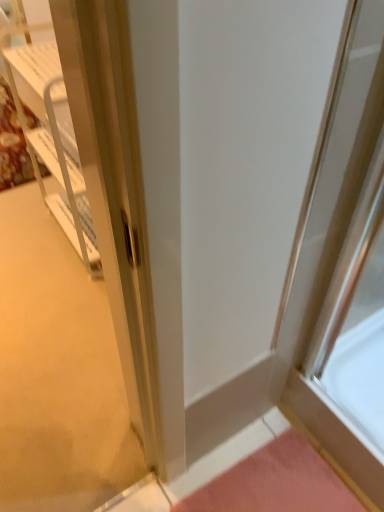
Question: Looking at their shapes, would you say white plastic cabinet at left is wider or thinner than pink fabric doormat at lower right?

Choices:
 (A) thin
 (B) wide

Answer: (A)

Question: Visually, is white plastic cabinet at left positioned to the left or to the right of pink fabric doormat at lower right?

Choices:
 (A) right
 (B) left

Answer: (B)

Question: Does point [x=16, y=29] appear closer or farther from the camera than point [x=203, y=489]?

Choices:
 (A) closer
 (B) farther

Answer: (B)

Question: From the image's perspective, relative to white plastic cabinet at left, is pink fabric doormat at lower right above or below?

Choices:
 (A) below
 (B) above

Answer: (A)

Question: Is point (236, 500) positioned closer to the camera than point (41, 193)?

Choices:
 (A) closer
 (B) farther

Answer: (A)

Question: In terms of size, does pink fabric doormat at lower right appear bigger or smaller than white plastic cabinet at left?

Choices:
 (A) big
 (B) small

Answer: (B)

Question: Considering the positions of pink fabric doormat at lower right and white plastic cabinet at left in the image, is pink fabric doormat at lower right wider or thinner than white plastic cabinet at left?

Choices:
 (A) wide
 (B) thin

Answer: (A)